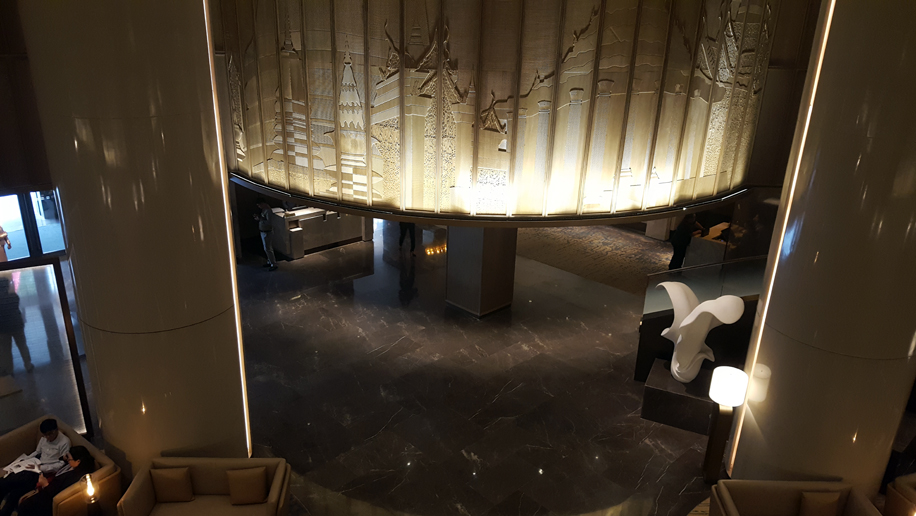
Find the location of `column`. column is located at coordinates (102, 284), (858, 254).